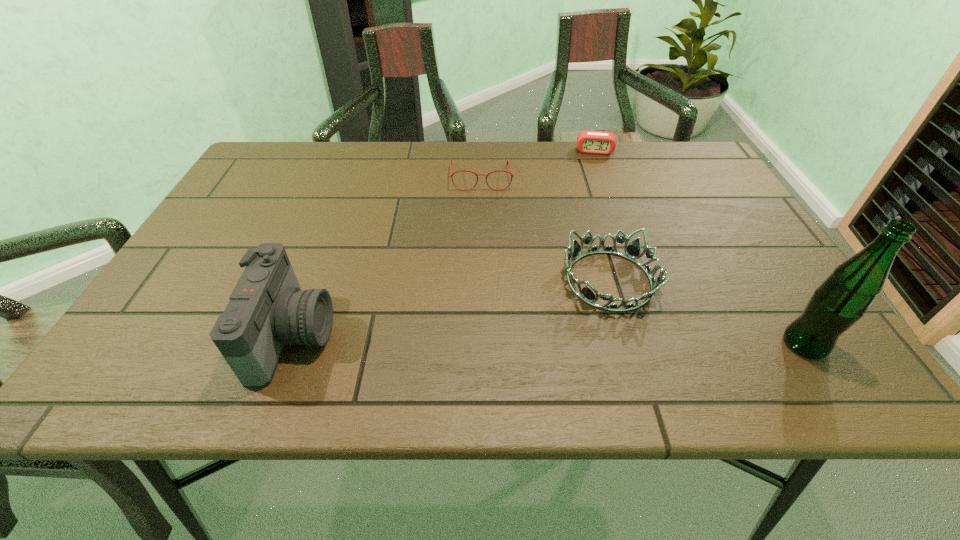
Where is `beer bottle present at the near edge`? beer bottle present at the near edge is located at coordinates (844, 297).

The image size is (960, 540). I want to click on tiara present at the near edge, so click(632, 251).

Find the location of a particular element. Image resolution: width=960 pixels, height=540 pixels. object positioned at the right edge is located at coordinates (844, 297).

In order to click on object that is at the near right corner in this screenshot , I will do `click(844, 297)`.

In the image, there is a desktop. Identify the location of vacant space at the far edge. (634, 166).

Where is `vacant space at the left edge of the desktop`? vacant space at the left edge of the desktop is located at coordinates click(x=252, y=189).

Identify the location of vacant space at the right edge. (717, 198).

Locate an element on the screen. The height and width of the screenshot is (540, 960). free space at the far right corner of the desktop is located at coordinates (643, 148).

What are the coordinates of `vacant area between the camera and the beer bottle` in the screenshot? It's located at click(549, 340).

Image resolution: width=960 pixels, height=540 pixels. I want to click on free space between the alarm clock and the camera, so click(x=444, y=244).